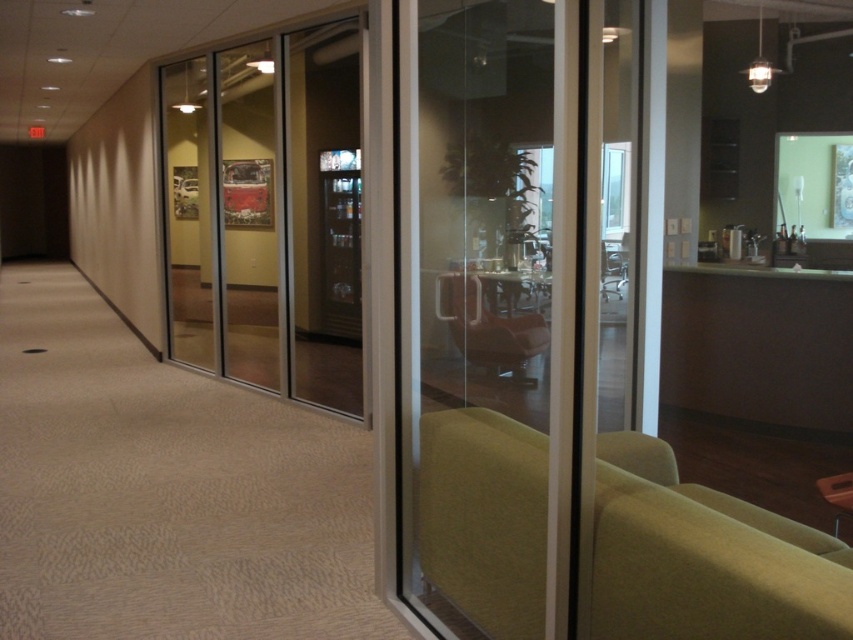
In the scene shown: You are a delivery robot with a 1.2 meter wide package. You need to move through the hallway and pass between the transparent glass door at center and the matte green armchair at center. Is there enough space for your package to fit through the gap?

The distance between the transparent glass door at center and the matte green armchair at center is 1.86 meters. Since your package is 1.2 meters wide, there is sufficient space for it to pass through the gap as 1.86 meters is greater than 1.2 meters.

You are a delivery person carrying a package that is 22 feet long. You need to pass through the transparent glass door at center. Can you fit through it?

The transparent glass door at center is 21.17 feet from camera, so the package that is 22 feet long is longer than the distance available. Therefore, you cannot fit through the transparent glass door at center.

You are an office worker trying to find the break room. You see a clear glass door at center and a green fabric armchair at lower right. Which object is larger in size?

The clear glass door at center is bigger than the green fabric armchair at lower right, so the clear glass door at center is larger in size.